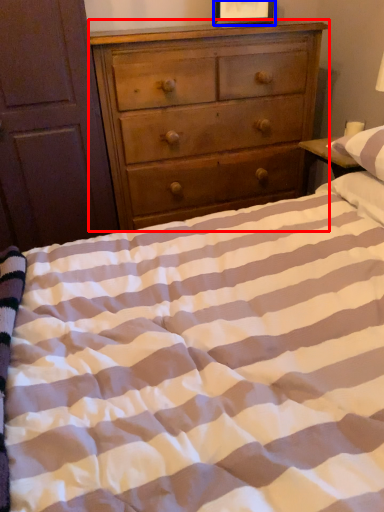
Question: Among these objects, which one is farthest to the camera, chest of drawers (highlighted by a red box) or picture frame (highlighted by a blue box)?

Choices:
 (A) chest of drawers
 (B) picture frame

Answer: (B)